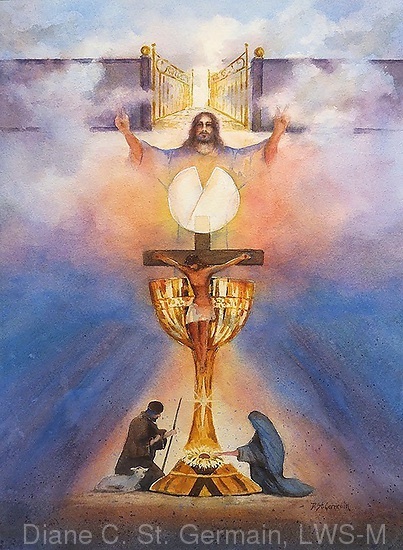
Where is `gold cup`? gold cup is located at coordinates (164, 299).